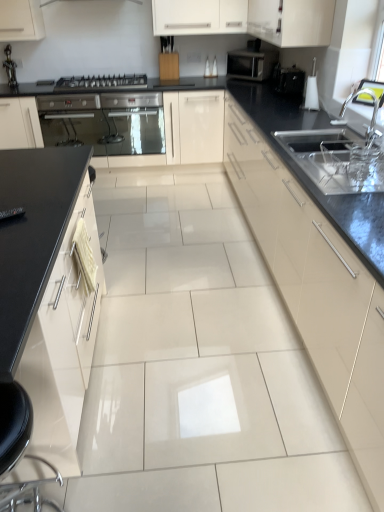
Question: In which direction should I rotate to look at matte cream cabinet at center, which appears as the second cabinetry when viewed from the right?

Choices:
 (A) left
 (B) right

Answer: (B)

Question: From the image's perspective, would you say metallic silver gas stove at center-left is shown under silver metallic faucet at upper right?

Choices:
 (A) yes
 (B) no

Answer: (B)

Question: Is metallic silver gas stove at center-left outside of silver metallic faucet at upper right?

Choices:
 (A) no
 (B) yes

Answer: (B)

Question: Can you confirm if metallic silver gas stove at center-left is bigger than silver metallic faucet at upper right?

Choices:
 (A) yes
 (B) no

Answer: (A)

Question: Are metallic silver gas stove at center-left and silver metallic faucet at upper right beside each other?

Choices:
 (A) yes
 (B) no

Answer: (B)

Question: Is metallic silver gas stove at center-left facing towards silver metallic faucet at upper right?

Choices:
 (A) yes
 (B) no

Answer: (A)

Question: From a real-world perspective, is metallic silver gas stove at center-left on top of silver metallic faucet at upper right?

Choices:
 (A) no
 (B) yes

Answer: (A)

Question: Is white glossy cabinet at left, which ranks as the 4th cabinetry in right-to-left order, facing towards black glossy toaster at upper right?

Choices:
 (A) yes
 (B) no

Answer: (B)

Question: Is the depth of white glossy cabinet at left, which ranks as the first cabinetry in left-to-right order, less than that of black glossy toaster at upper right?

Choices:
 (A) no
 (B) yes

Answer: (B)

Question: Is white glossy cabinet at left, which ranks as the first cabinetry in left-to-right order, outside of black glossy toaster at upper right?

Choices:
 (A) yes
 (B) no

Answer: (A)

Question: Is white glossy cabinet at left, which ranks as the 4th cabinetry in right-to-left order, behind black glossy toaster at upper right?

Choices:
 (A) yes
 (B) no

Answer: (B)

Question: From the image's perspective, does white glossy cabinet at left, which ranks as the first cabinetry in left-to-right order, appear higher than black glossy toaster at upper right?

Choices:
 (A) yes
 (B) no

Answer: (B)

Question: From a real-world perspective, is white glossy cabinet at left, which ranks as the 4th cabinetry in right-to-left order, physically below black glossy toaster at upper right?

Choices:
 (A) yes
 (B) no

Answer: (A)

Question: Does matte black microwave at upper right have a greater width compared to black glossy toaster at upper right?

Choices:
 (A) no
 (B) yes

Answer: (B)